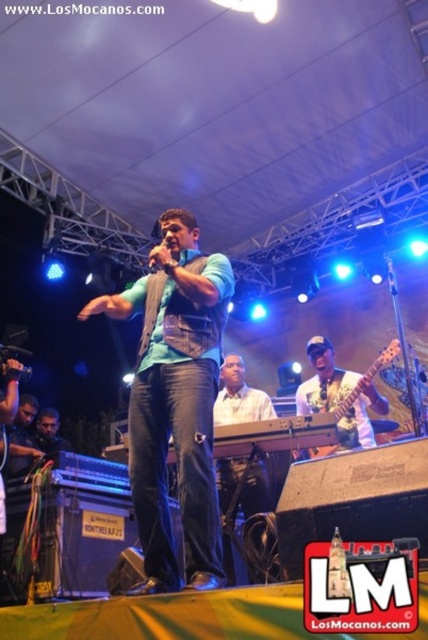
Question: From the image, what is the correct spatial relationship of white matte guitar at center in relation to black matte microphone at center?

Choices:
 (A) below
 (B) above

Answer: (A)

Question: Is matte green vest at center to the left of black matte microphone at center from the viewer's perspective?

Choices:
 (A) no
 (B) yes

Answer: (B)

Question: Among these objects, which one is nearest to the camera?

Choices:
 (A) matte green vest at center
 (B) black matte microphone at center
 (C) white matte guitar at center

Answer: (A)

Question: Which object appears farthest from the camera in this image?

Choices:
 (A) black matte microphone at center
 (B) white matte guitar at center

Answer: (B)

Question: Which point is closer to the camera?

Choices:
 (A) matte green vest at center
 (B) black matte microphone at center
 (C) white matte guitar at center

Answer: (A)

Question: Considering the relative positions of matte green vest at center and black matte microphone at center in the image provided, where is matte green vest at center located with respect to black matte microphone at center?

Choices:
 (A) right
 (B) left

Answer: (B)